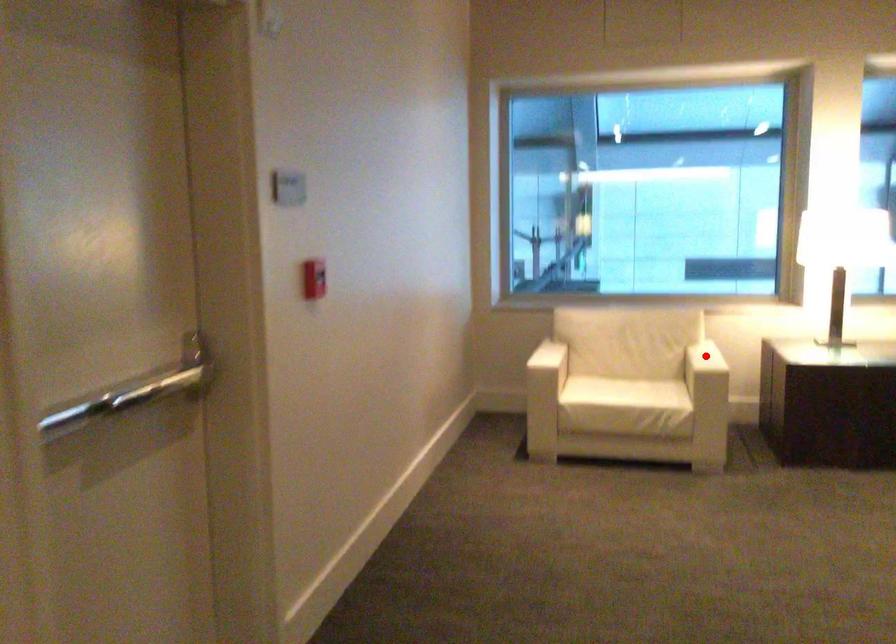
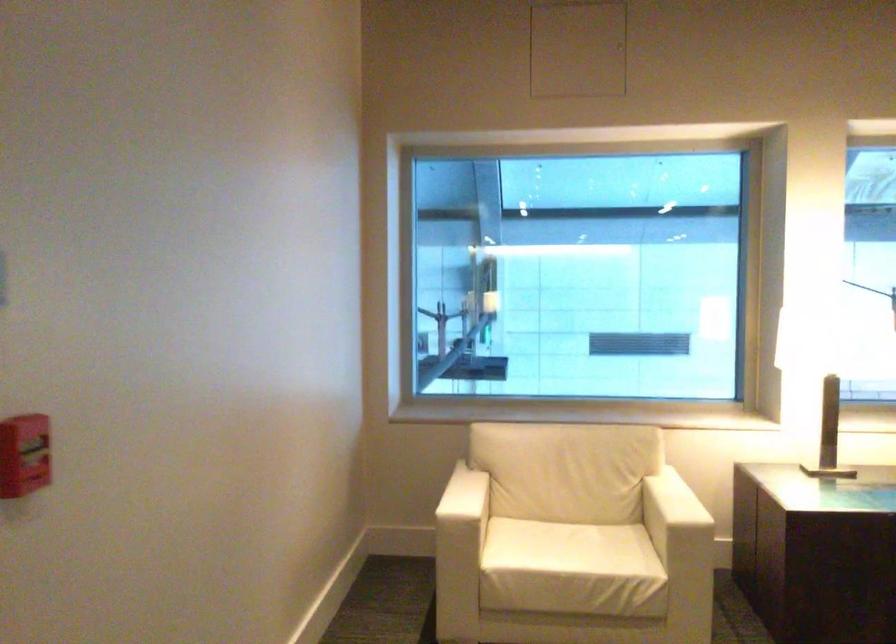
Question: I am providing you with two images of the same scene from different viewpoints. Image1 has a red point marked. In image2, the corresponding 3D location appears at what relative position? Reply with the corresponding letter.

Choices:
 (A) Closer
 (B) Farther

Answer: (A)